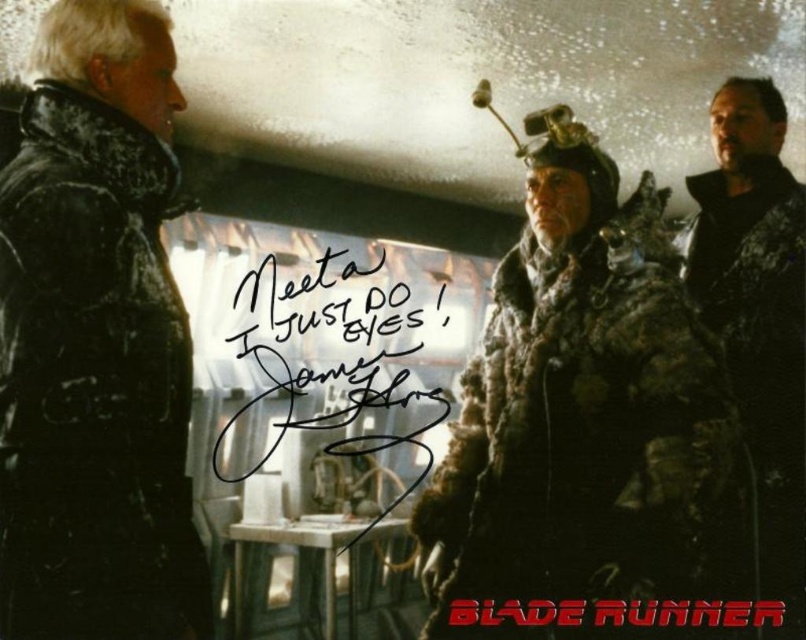
You are navigating a dimly lit industrial facility from the movie Blade Runner. You need to locate the fuzzy fur coat at center. According to the coordinates provided, where exactly is it positioned?

The fuzzy fur coat at center is located at point (578, 410).

You are a character in the movie Blade Runner. You need to read the black ink writing at center but the camouflage jacket at right is blocking your view. Can you tell me if the writing is taller or shorter than the jacket?

The black ink writing at center is shorter than the camouflage jacket at right, so the writing is shorter than the jacket.

You are an observer in the scene described. You notice the camouflage jacket at right and the red plastic text at center. Which object takes up more space in the image?

The camouflage jacket at right is larger in size than the red plastic text at center, so it takes up more space in the image.